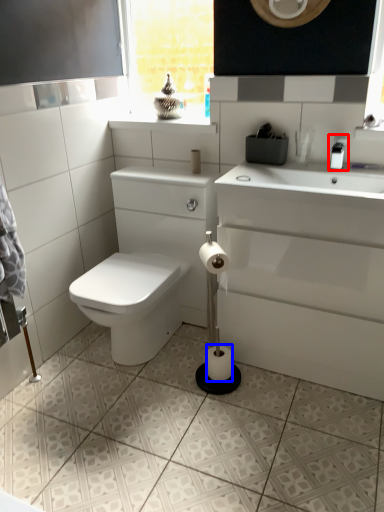
Question: Which object is closer to the camera taking this photo, faucet (highlighted by a red box) or toilet paper (highlighted by a blue box)?

Choices:
 (A) faucet
 (B) toilet paper

Answer: (A)